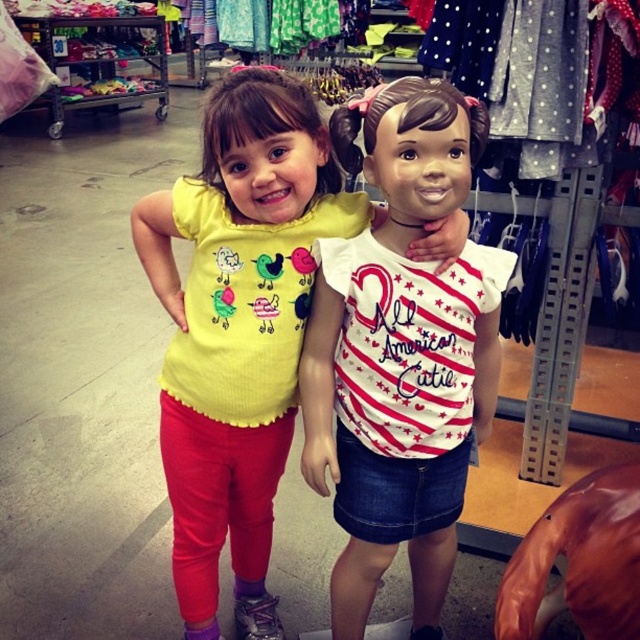
You are a store employee organizing the children clothing section. You have a display rack that can only accommodate shirts with a width of 30 cm or less. You see the yellow matte shirt at center and the white matte shirt at center. Which shirt should you choose to place on the rack?

The white matte shirt at center should be chosen because its width is smaller than the yellow matte shirt at center, making it suitable for the display rack with a 30 cm width limit.

You are a store employee organizing a display. You need to place a new tag exactly 0.2 meters to the right of the yellow matte shirt at center. Where should you place the tag in the coordinate system described in the Objects Description?

The tag should be placed at coordinate point 0.514 plus 0.2 meters to the right, so the new coordinate would be approximately 0.714 on the x axis, maintaining the same y coordinate of 0.373. Therefore, the tag should be placed at point (x=237, y=456).